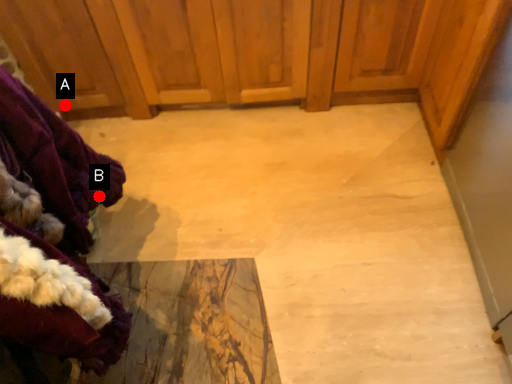
Question: Two points are circled on the image, labeled by A and B beside each circle. Among these points, which one is farthest from the camera?

Choices:
 (A) A is further
 (B) B is further

Answer: (A)